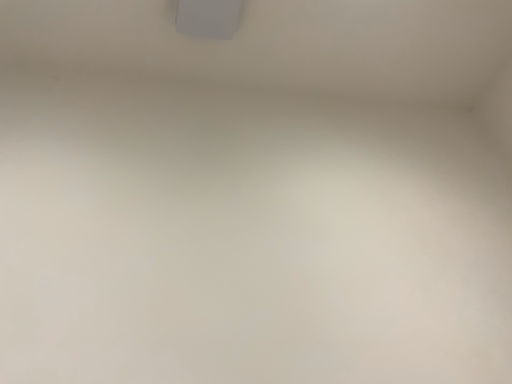
This screenshot has width=512, height=384. Describe the element at coordinates (208, 18) in the screenshot. I see `white plastic light switch at upper center` at that location.

Where is `white plastic light switch at upper center`? This screenshot has width=512, height=384. white plastic light switch at upper center is located at coordinates (208, 18).

This screenshot has width=512, height=384. In order to click on white plastic light switch at upper center in this screenshot , I will do `click(208, 18)`.